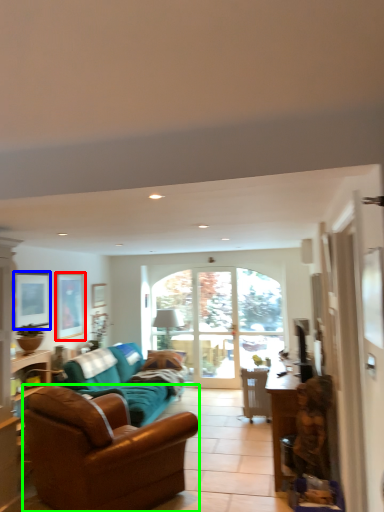
Question: Which object is the closest to the picture frame (highlighted by a red box)? Choose among these: picture frame (highlighted by a blue box) or studio couch (highlighted by a green box).

Choices:
 (A) picture frame
 (B) studio couch

Answer: (A)